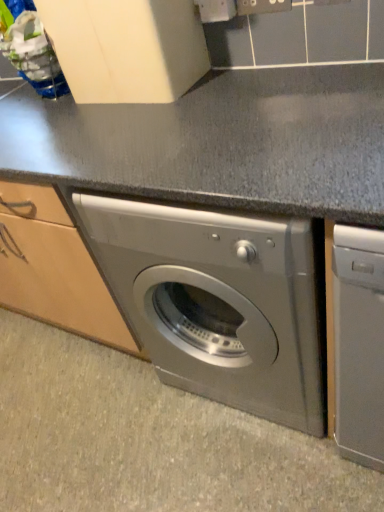
Question: Is satin silver washing machine at center taller or shorter than slate gray granite at center?

Choices:
 (A) tall
 (B) short

Answer: (A)

Question: Do you think satin silver washing machine at center is within slate gray granite at center, or outside of it?

Choices:
 (A) inside
 (B) outside

Answer: (B)

Question: Looking at the image, does satin silver washing machine at center seem bigger or smaller compared to slate gray granite at center?

Choices:
 (A) big
 (B) small

Answer: (A)

Question: Based on their sizes in the image, would you say slate gray granite at center is bigger or smaller than satin silver washing machine at center?

Choices:
 (A) big
 (B) small

Answer: (B)

Question: From a real-world perspective, is slate gray granite at center above or below satin silver washing machine at center?

Choices:
 (A) above
 (B) below

Answer: (B)

Question: Relative to satin silver washing machine at center, is slate gray granite at center in front or behind?

Choices:
 (A) behind
 (B) front

Answer: (A)

Question: From their relative heights in the image, would you say slate gray granite at center is taller or shorter than satin silver washing machine at center?

Choices:
 (A) tall
 (B) short

Answer: (B)